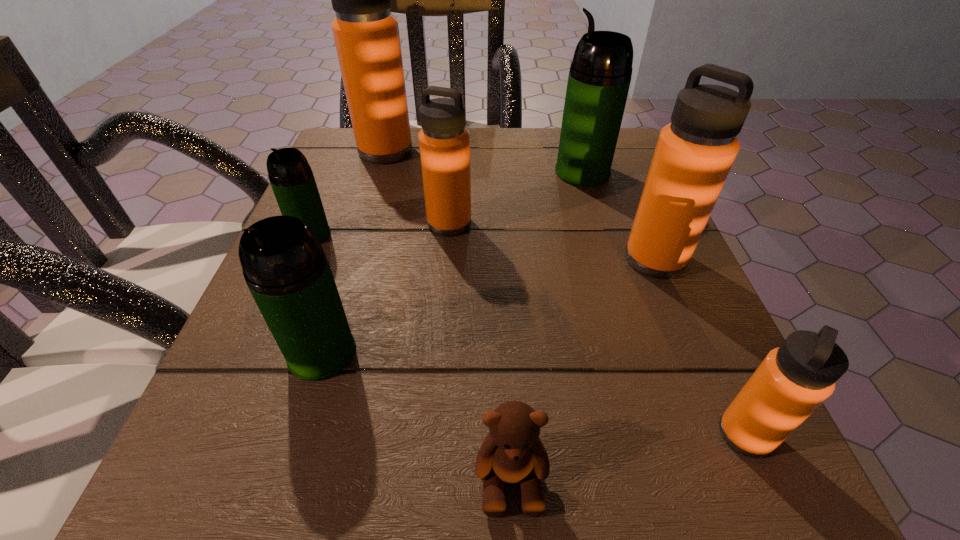
Locate an element on the screen. the smallest green thermos bottle is located at coordinates (290, 175).

I want to click on the nearest thermos bottle, so click(793, 380).

This screenshot has height=540, width=960. Find the location of `the nearest orange thermos bottle`. the nearest orange thermos bottle is located at coordinates (793, 380).

Find the location of a particular element. The height and width of the screenshot is (540, 960). the fourth object from right to left is located at coordinates (512, 452).

The width and height of the screenshot is (960, 540). What are the coordinates of `brown teddy bear` in the screenshot? It's located at tap(512, 452).

Locate an element on the screen. The image size is (960, 540). free spot located on the right of the tallest object is located at coordinates (568, 151).

Where is `blank space located 0.100m from the spout of the rightmost green thermos bottle`? blank space located 0.100m from the spout of the rightmost green thermos bottle is located at coordinates (506, 172).

Image resolution: width=960 pixels, height=540 pixels. Identify the location of vacant space located 0.120m from the spout of the rightmost green thermos bottle. (496, 172).

This screenshot has width=960, height=540. Identify the location of free region located 0.320m from the spout of the rightmost green thermos bottle. (399, 172).

The image size is (960, 540). What are the coordinates of `vacant space located on the back of the second biggest orange thermos bottle` in the screenshot? It's located at (614, 161).